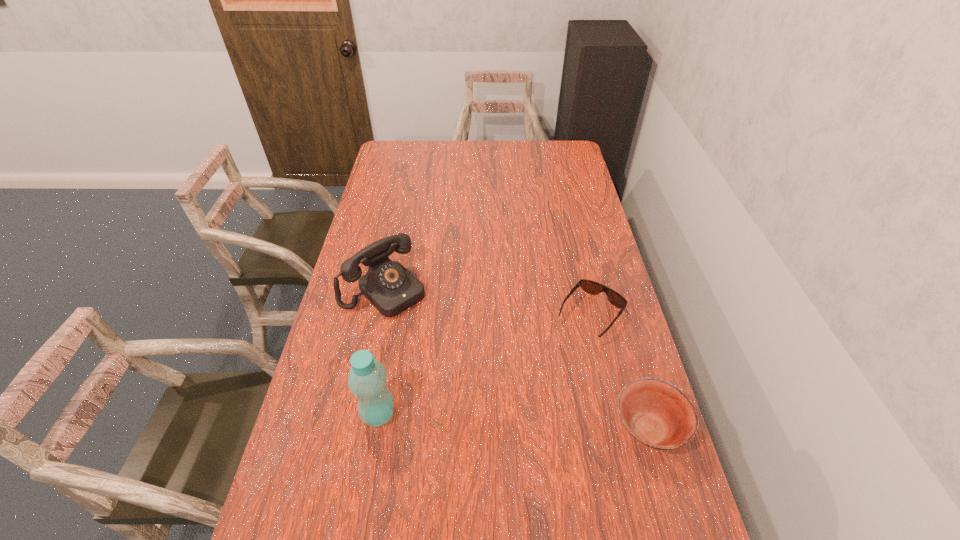
Identify the location of free area in between the tallest object and the telephone. (382, 352).

Where is `object that is the nearest to the bottle`? The height and width of the screenshot is (540, 960). object that is the nearest to the bottle is located at coordinates (389, 286).

This screenshot has height=540, width=960. I want to click on object that stands as the third closest to the telephone, so click(657, 414).

Where is `vacant space that satisfies the following two spatial constraints: 1. on the back side of the tallest object; 2. on the left side of the shortest object`? The height and width of the screenshot is (540, 960). vacant space that satisfies the following two spatial constraints: 1. on the back side of the tallest object; 2. on the left side of the shortest object is located at coordinates (396, 315).

At what (x,y) coordinates should I click in order to perform the action: click on free space that satisfies the following two spatial constraints: 1. on the front side of the sunglasses; 2. on the right side of the telephone. Please return your answer as a coordinate pair (x, y). The width and height of the screenshot is (960, 540). Looking at the image, I should click on (379, 315).

In order to click on vacant area in the image that satisfies the following two spatial constraints: 1. on the front side of the third shortest object; 2. on the left side of the bottle in this screenshot , I will do `click(358, 414)`.

At what (x,y) coordinates should I click in order to perform the action: click on free space that satisfies the following two spatial constraints: 1. on the front side of the third tallest object; 2. on the left side of the bottle. Please return your answer as a coordinate pair (x, y). This screenshot has width=960, height=540. Looking at the image, I should click on (376, 430).

The width and height of the screenshot is (960, 540). In order to click on vacant space that satisfies the following two spatial constraints: 1. on the front side of the bowl; 2. on the left side of the second tallest object in this screenshot , I will do click(355, 430).